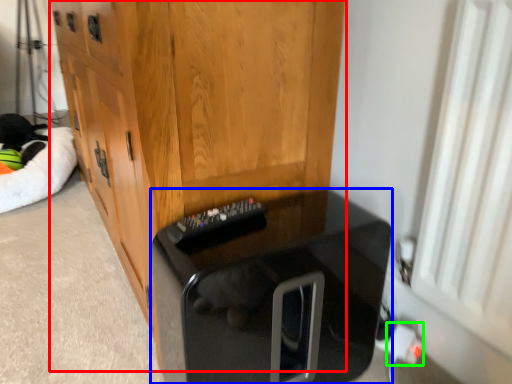
Question: Considering the real-world distances, which object is closest to cabinetry (highlighted by a red box)? furniture (highlighted by a blue box) or electric outlet (highlighted by a green box).

Choices:
 (A) furniture
 (B) electric outlet

Answer: (A)